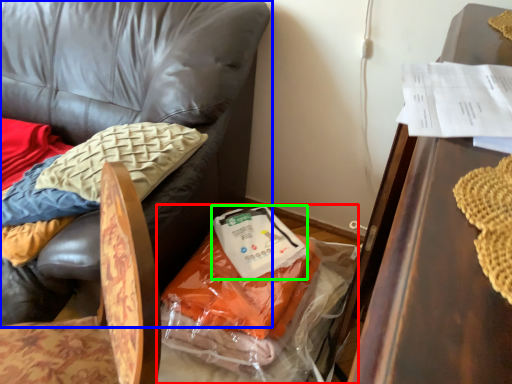
Question: Considering the real-world distances, which object is closest to garbage (highlighted by a red box)? chair (highlighted by a blue box) or food (highlighted by a green box).

Choices:
 (A) chair
 (B) food

Answer: (B)